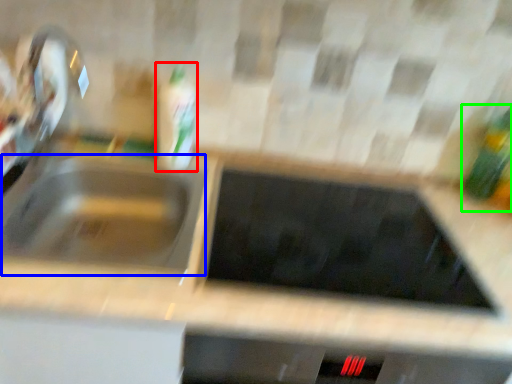
Question: Based on their relative distances, which object is farther from bottle (highlighted by a red box)? Choose from sink (highlighted by a blue box) and bottle (highlighted by a green box).

Choices:
 (A) sink
 (B) bottle

Answer: (B)